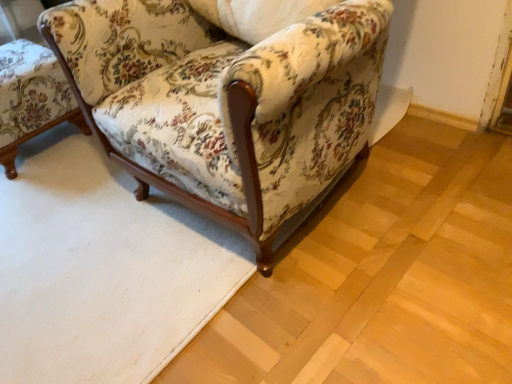
What do you see at coordinates (227, 97) in the screenshot? The width and height of the screenshot is (512, 384). I see `floral fabric chair at center, acting as the 2th chair starting from the left` at bounding box center [227, 97].

You are a GUI agent. You are given a task and a screenshot of the screen. Output one action in this format:
    pyautogui.click(x=<x>, y=<y>)
    Task: Click on the floral fabric chair at center, which is the first chair in right-to-left order
    This screenshot has width=512, height=384.
    Given the screenshot: What is the action you would take?
    pyautogui.click(x=227, y=97)

Locate an element on the screen. The image size is (512, 384). wooden armchair at left, the first chair from the left is located at coordinates (31, 98).

What do you see at coordinates (31, 98) in the screenshot? I see `wooden armchair at left, which is counted as the second chair, starting from the right` at bounding box center [31, 98].

The height and width of the screenshot is (384, 512). Identify the location of floral fabric chair at center, acting as the 2th chair starting from the left. (227, 97).

Which object is positioned more to the right, floral fabric chair at center, which is the first chair in right-to-left order, or wooden armchair at left, which is counted as the second chair, starting from the right?

Positioned to the right is floral fabric chair at center, which is the first chair in right-to-left order.

From the picture: Between floral fabric chair at center, acting as the 2th chair starting from the left, and wooden armchair at left, the first chair from the left, which one is positioned behind?

wooden armchair at left, the first chair from the left, is further away from the camera.

Which point is more forward, (200, 156) or (0, 127)?

The point (200, 156) is closer.

From the image's perspective, between floral fabric chair at center, acting as the 2th chair starting from the left, and wooden armchair at left, the first chair from the left, which one is located above?

wooden armchair at left, the first chair from the left.

From a real-world perspective, is floral fabric chair at center, which is the first chair in right-to-left order, over wooden armchair at left, which is counted as the second chair, starting from the right?

Yes.

Between floral fabric chair at center, which is the first chair in right-to-left order, and wooden armchair at left, the first chair from the left, which one has smaller width?

wooden armchair at left, the first chair from the left, is thinner.

Considering the relative sizes of floral fabric chair at center, which is the first chair in right-to-left order, and wooden armchair at left, the first chair from the left, in the image provided, is floral fabric chair at center, which is the first chair in right-to-left order, taller than wooden armchair at left, the first chair from the left,?

Yes, floral fabric chair at center, which is the first chair in right-to-left order, is taller than wooden armchair at left, the first chair from the left.

Between floral fabric chair at center, which is the first chair in right-to-left order, and wooden armchair at left, the first chair from the left, which one has larger size?

Answer: floral fabric chair at center, which is the first chair in right-to-left order.

Looking at this image, would you say floral fabric chair at center, which is the first chair in right-to-left order, is outside wooden armchair at left, which is counted as the second chair, starting from the right?

Indeed, floral fabric chair at center, which is the first chair in right-to-left order, is completely outside wooden armchair at left, which is counted as the second chair, starting from the right.

Is floral fabric chair at center, acting as the 2th chair starting from the left, not near wooden armchair at left, the first chair from the left?

They are positioned close to each other.

Does floral fabric chair at center, acting as the 2th chair starting from the left, turn towards wooden armchair at left, which is counted as the second chair, starting from the right?

No, floral fabric chair at center, acting as the 2th chair starting from the left, is not facing towards wooden armchair at left, which is counted as the second chair, starting from the right.

Image resolution: width=512 pixels, height=384 pixels. I want to click on chair below the wooden armchair at left, which is counted as the second chair, starting from the right (from the image's perspective), so click(x=227, y=97).

Which is more to the left, wooden armchair at left, the first chair from the left, or floral fabric chair at center, which is the first chair in right-to-left order?

From the viewer's perspective, wooden armchair at left, the first chair from the left, appears more on the left side.

Is wooden armchair at left, the first chair from the left, further to camera compared to floral fabric chair at center, which is the first chair in right-to-left order?

Yes.

Is point (6, 50) farther from viewer compared to point (198, 120)?

Yes, point (6, 50) is farther from viewer.

From the image's perspective, is wooden armchair at left, which is counted as the second chair, starting from the right, above or below floral fabric chair at center, acting as the 2th chair starting from the left?

From the image's perspective, wooden armchair at left, which is counted as the second chair, starting from the right, appears above floral fabric chair at center, acting as the 2th chair starting from the left.

From a real-world perspective, which is physically above, wooden armchair at left, the first chair from the left, or floral fabric chair at center, acting as the 2th chair starting from the left?

floral fabric chair at center, acting as the 2th chair starting from the left, is physically above.

Which object is wider, wooden armchair at left, which is counted as the second chair, starting from the right, or floral fabric chair at center, acting as the 2th chair starting from the left?

floral fabric chair at center, acting as the 2th chair starting from the left, is wider.

In terms of height, does wooden armchair at left, which is counted as the second chair, starting from the right, look taller or shorter compared to floral fabric chair at center, acting as the 2th chair starting from the left?

Considering their sizes, wooden armchair at left, which is counted as the second chair, starting from the right, has less height than floral fabric chair at center, acting as the 2th chair starting from the left.

Between wooden armchair at left, the first chair from the left, and floral fabric chair at center, which is the first chair in right-to-left order, which one has larger size?

Bigger between the two is floral fabric chair at center, which is the first chair in right-to-left order.

Is floral fabric chair at center, which is the first chair in right-to-left order, located within wooden armchair at left, the first chair from the left?

No, wooden armchair at left, the first chair from the left, does not contain floral fabric chair at center, which is the first chair in right-to-left order.

Is wooden armchair at left, the first chair from the left, far away from floral fabric chair at center, which is the first chair in right-to-left order?

No.

Is wooden armchair at left, which is counted as the second chair, starting from the right, looking in the opposite direction of floral fabric chair at center, which is the first chair in right-to-left order?

That's not correct — wooden armchair at left, which is counted as the second chair, starting from the right, is not looking away from floral fabric chair at center, which is the first chair in right-to-left order.

How different are the orientations of wooden armchair at left, the first chair from the left, and floral fabric chair at center, which is the first chair in right-to-left order, in degrees?

wooden armchair at left, the first chair from the left, and floral fabric chair at center, which is the first chair in right-to-left order, are facing 177 degrees away from each other.

Measure the distance between wooden armchair at left, which is counted as the second chair, starting from the right, and floral fabric chair at center, acting as the 2th chair starting from the left.

wooden armchair at left, which is counted as the second chair, starting from the right, is 27.81 inches from floral fabric chair at center, acting as the 2th chair starting from the left.

Where is `chair below the wooden armchair at left, the first chair from the left (from the image's perspective)`? chair below the wooden armchair at left, the first chair from the left (from the image's perspective) is located at coordinates (227, 97).

In the image, there is a wooden armchair at left, the first chair from the left. Identify the location of chair below it (from the image's perspective). [x=227, y=97].

In the image, there is a floral fabric chair at center, acting as the 2th chair starting from the left. At what (x,y) coordinates should I click in order to perform the action: click on chair above it (from the image's perspective). Please return your answer as a coordinate pair (x, y). Looking at the image, I should click on (31, 98).